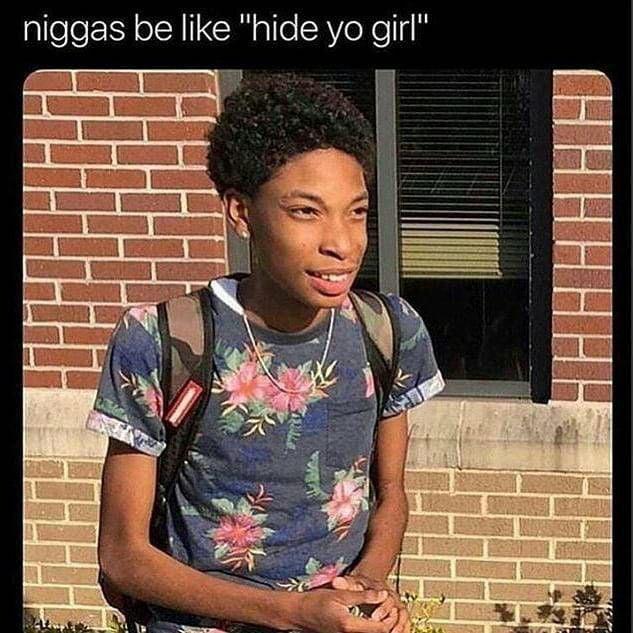
At what (x,y) coordinates should I click in order to perform the action: click on brick wall. Please return your answer as a coordinate pair (x, y). Looking at the image, I should click on (108, 154).